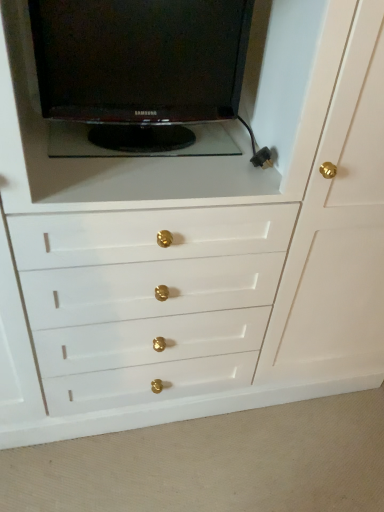
Locate an element on the screen. The height and width of the screenshot is (512, 384). black glossy television at upper left is located at coordinates (140, 67).

The image size is (384, 512). What do you see at coordinates (140, 67) in the screenshot?
I see `black glossy television at upper left` at bounding box center [140, 67].

Identify the location of black glossy television at upper left. (140, 67).